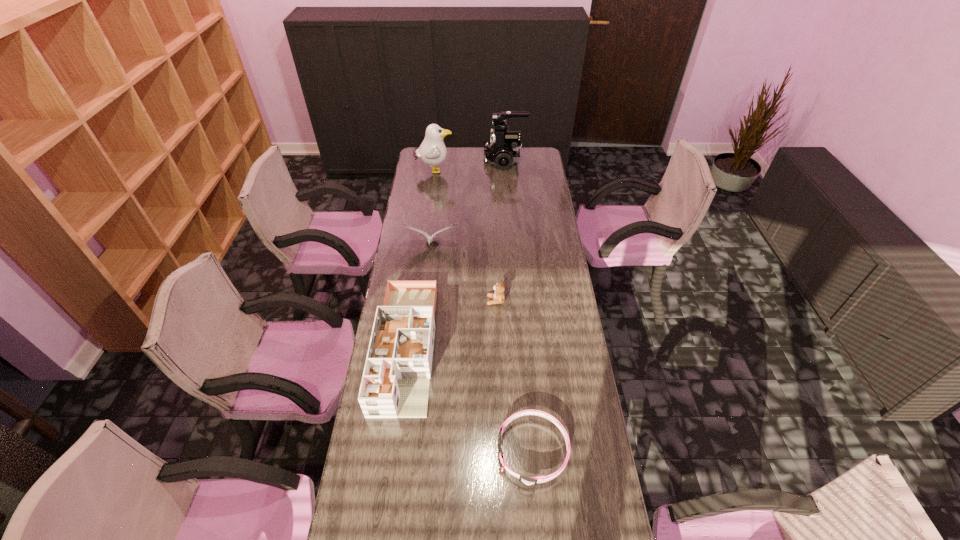
Locate an element on the screen. Image resolution: width=960 pixels, height=540 pixels. free spot between the shorter gull and the teddy bear is located at coordinates (464, 274).

You are a GUI agent. You are given a task and a screenshot of the screen. Output one action in this format:
    pyautogui.click(x=<x>, y=<y>)
    Task: Click on the empty space that is in between the shorter gull and the farther gull
    This screenshot has width=960, height=540.
    Given the screenshot: What is the action you would take?
    pyautogui.click(x=433, y=208)

Where is `vacant region between the teddy bear and the shortest object`? This screenshot has height=540, width=960. vacant region between the teddy bear and the shortest object is located at coordinates (515, 376).

At what (x,y) coordinates should I click in order to perform the action: click on free space between the farther gull and the camcorder. Please return your answer as a coordinate pair (x, y). The height and width of the screenshot is (540, 960). Looking at the image, I should click on (469, 165).

Where is `empty location between the dog collar and the teddy bear`? empty location between the dog collar and the teddy bear is located at coordinates (515, 376).

The height and width of the screenshot is (540, 960). In order to click on vacant point located between the shortest object and the teddy bear in this screenshot , I will do `click(515, 376)`.

I want to click on free spot between the camcorder and the dollhouse, so click(x=455, y=254).

You are a GUI agent. You are given a task and a screenshot of the screen. Output one action in this format:
    pyautogui.click(x=<x>, y=<y>)
    Task: Click on the free spot between the camcorder and the teddy bear
    
    Given the screenshot: What is the action you would take?
    pyautogui.click(x=500, y=231)

Identify the location of object that is the nearest to the dollhouse. The height and width of the screenshot is (540, 960). (498, 296).

Where is `object that stands as the third closest to the camcorder`? The image size is (960, 540). object that stands as the third closest to the camcorder is located at coordinates (498, 296).